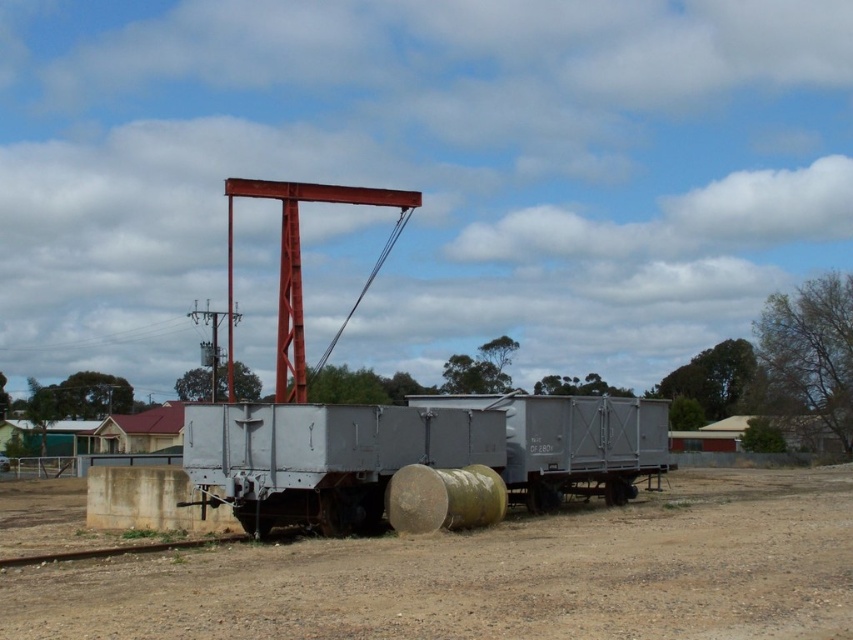
You are standing at the edge of the scene and want to place a new object at the exact center of the dull brown dirt at center. According to the coordinates provided, where should you place it?

The dull brown dirt at center is located at point (x=492, y=576), so you should place the new object at those coordinates.

You are a maintenance worker inspecting the area around the dull brown dirt at center and the metallic gray train car at center. Which of these two objects occupies more space in the scene?

The dull brown dirt at center has a larger size compared to the metallic gray train car at center, so it occupies more space in the scene.